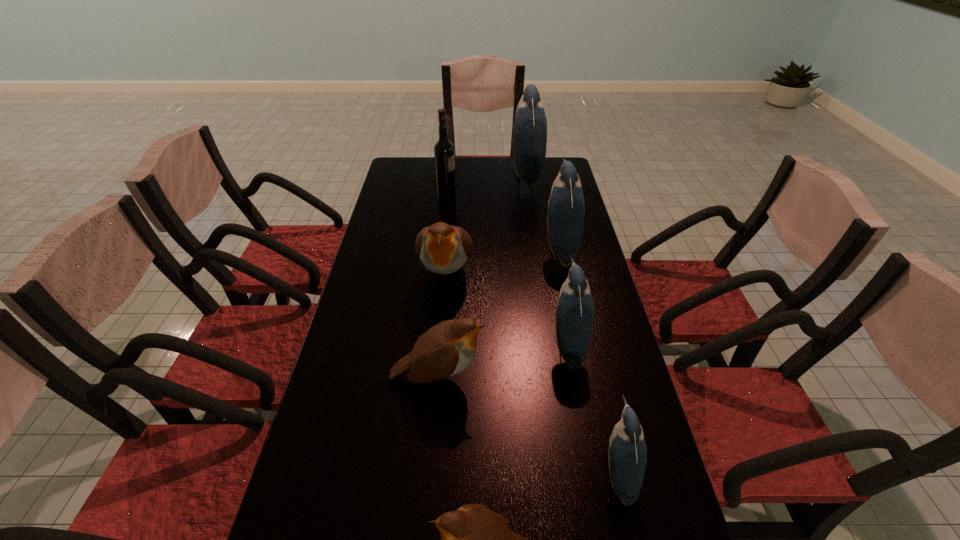
The width and height of the screenshot is (960, 540). What are the coordinates of `blue bird identified as the closest to the farthest brown bird` in the screenshot? It's located at (574, 309).

Locate an element on the screen. The height and width of the screenshot is (540, 960). the second closest blue bird to the second nearest object is located at coordinates [x=566, y=207].

Identify which brown bird is the closest to the sixth farthest bird. Please provide its 2D coordinates. Your answer should be formatted as a tuple, i.e. [(x, y)], where the tuple contains the x and y coordinates of a point satisfying the conditions above.

[(474, 539)]

Locate which brown bird ranks second in proximity to the biggest brown bird. Please provide its 2D coordinates. Your answer should be formatted as a tuple, i.e. [(x, y)], where the tuple contains the x and y coordinates of a point satisfying the conditions above.

[(474, 539)]